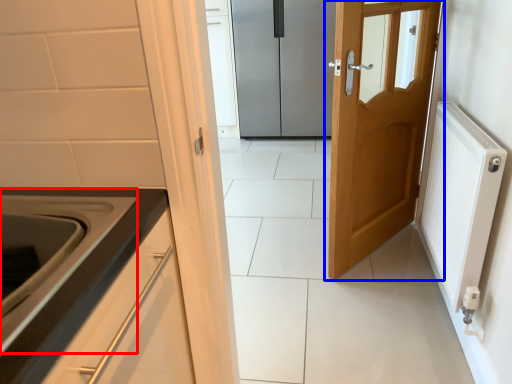
Question: Which object is further to the camera taking this photo, oven (highlighted by a red box) or door (highlighted by a blue box)?

Choices:
 (A) oven
 (B) door

Answer: (B)